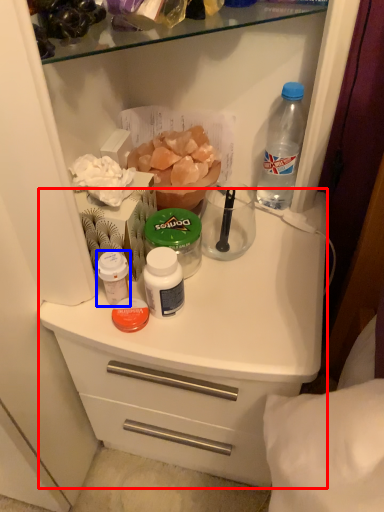
Question: Which object appears farthest to the camera in this image, counter (highlighted by a red box) or bottle (highlighted by a blue box)?

Choices:
 (A) counter
 (B) bottle

Answer: (B)